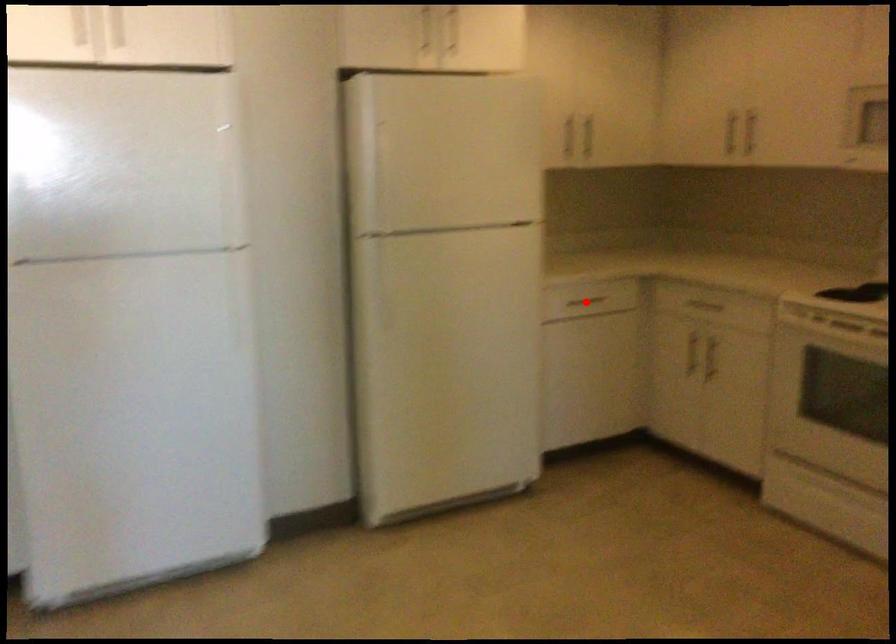
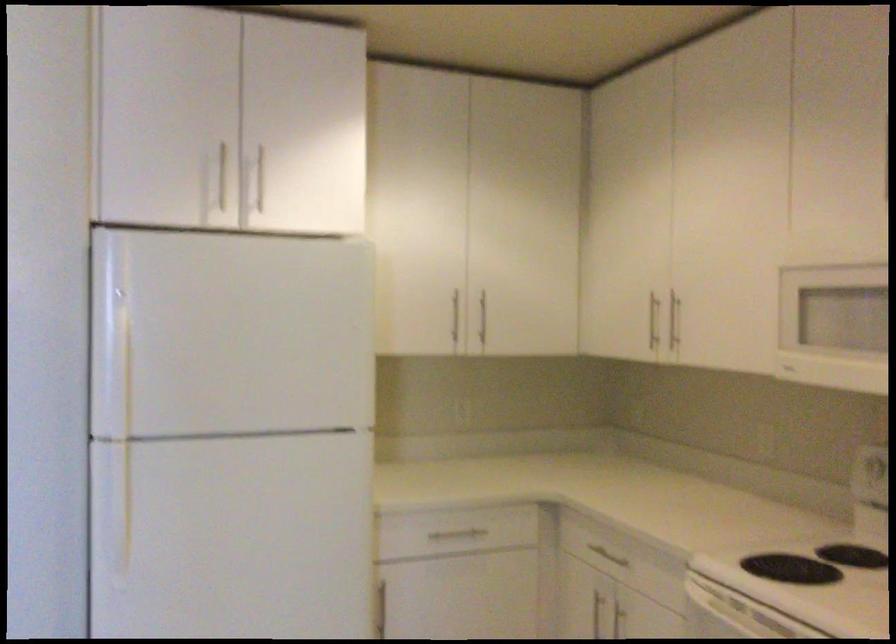
In the second image, find the point that corresponds to the highlighted location in the first image.

(455, 536)